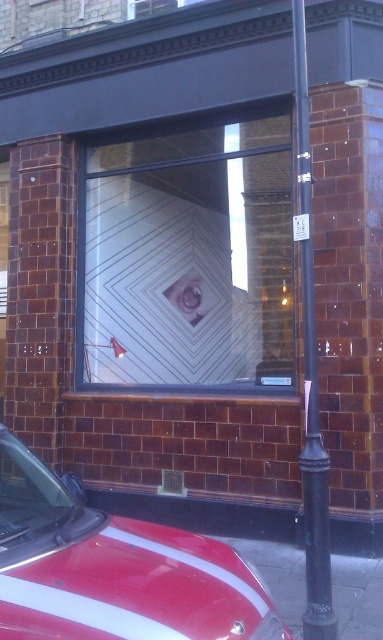
Which is below, black metal pole at right or matte white eye at center?

black metal pole at right

Looking at this image, is black metal pole at right bigger than matte white eye at center?

Yes, black metal pole at right is bigger than matte white eye at center.

Where is `black metal pole at right`? The height and width of the screenshot is (640, 383). black metal pole at right is located at coordinates (310, 378).

Does white matte wall at center appear over shiny red car at lower left?

Yes.

Between point (127, 381) and point (65, 621), which one is positioned in front?

Point (65, 621) is in front.

You are a GUI agent. You are given a task and a screenshot of the screen. Output one action in this format:
    pyautogui.click(x=<x>, y=<y>)
    Task: Click on the white matte wall at center
    
    Given the screenshot: What is the action you would take?
    pos(191,257)

Does white matte wall at center appear on the right side of black metal pole at right?

In fact, white matte wall at center is to the left of black metal pole at right.

Does white matte wall at center have a lesser width compared to black metal pole at right?

In fact, white matte wall at center might be wider than black metal pole at right.

Who is more forward, (255, 342) or (312, 339)?

Point (312, 339) is in front.

Locate an element on the screen. The height and width of the screenshot is (640, 383). white matte wall at center is located at coordinates (191, 257).